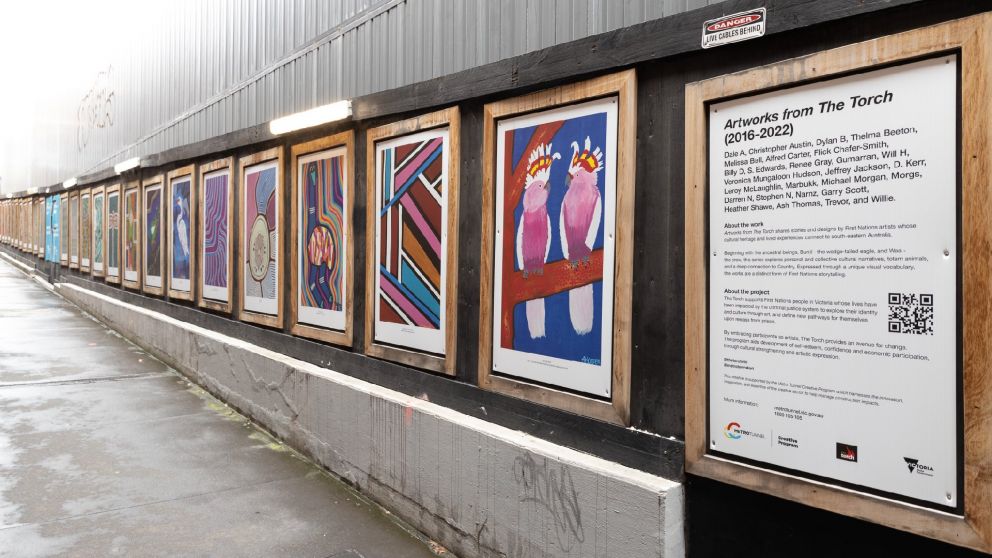
Locate an element on the screen. The image size is (992, 558). placard is located at coordinates (809, 181).